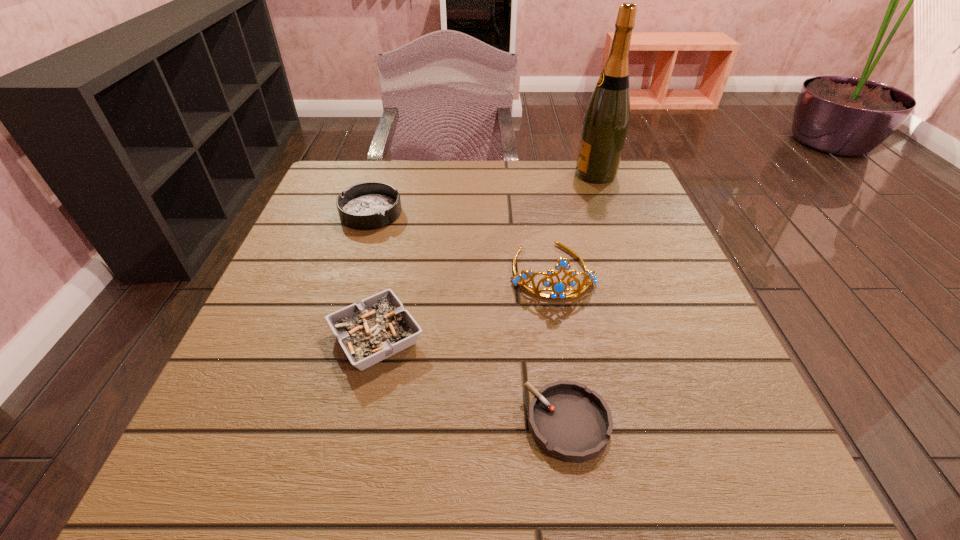
In order to click on empty location between the wine bottle and the fourth nearest object in this screenshot , I will do `click(483, 193)`.

The width and height of the screenshot is (960, 540). Identify the location of vacant space that's between the rightmost object and the rightmost ashtray. (582, 299).

Locate an element on the screen. The width and height of the screenshot is (960, 540). free space between the farthest object and the second nearest ashtray is located at coordinates (486, 256).

Identify the location of free space between the wine bottle and the farthest ashtray. This screenshot has width=960, height=540. (483, 193).

Locate an element on the screen. This screenshot has width=960, height=540. vacant space in between the second farthest ashtray and the tiara is located at coordinates (464, 305).

Find the location of a particular element. The image size is (960, 540). blank region between the rightmost object and the second farthest ashtray is located at coordinates (486, 256).

You are a GUI agent. You are given a task and a screenshot of the screen. Output one action in this format:
    pyautogui.click(x=<x>, y=<y>)
    Task: Click on the free spot between the nearest ashtray and the fourth nearest object
    This screenshot has width=960, height=540.
    Given the screenshot: What is the action you would take?
    click(469, 318)

Identify the location of free spot between the tiara and the rightmost ashtray. Image resolution: width=960 pixels, height=540 pixels. (560, 347).

Identify the location of the fourth closest object to the farthest ashtray. (568, 421).

Identify the location of object that is the third closest to the second tallest object. (606, 120).